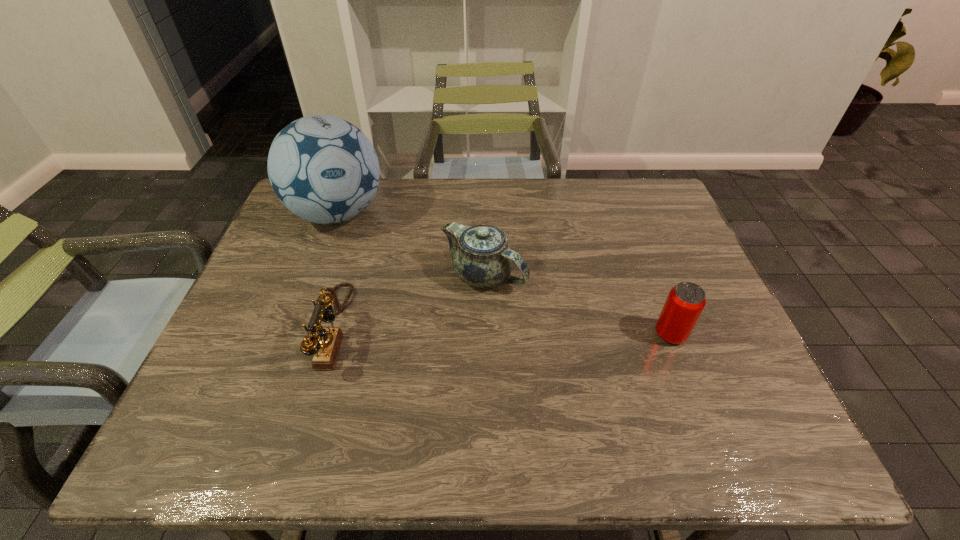
This screenshot has height=540, width=960. Identify the location of telephone. (325, 347).

This screenshot has height=540, width=960. What are the coordinates of `can` in the screenshot? It's located at (685, 302).

Find the location of `the tallest object`. the tallest object is located at coordinates (324, 169).

Identify the location of soccer ball. (324, 169).

Find the location of a particular element. the third object from left to right is located at coordinates (482, 257).

At what (x,y) coordinates should I click in order to perform the action: click on vacant area located on the front-facing side of the telephone. Please return your answer as a coordinate pair (x, y). Looking at the image, I should click on (264, 329).

At what (x,y) coordinates should I click in order to perform the action: click on vacant space located 0.190m on the front-facing side of the telephone. Please return your answer as a coordinate pair (x, y). Looking at the image, I should click on (238, 329).

You are a GUI agent. You are given a task and a screenshot of the screen. Output one action in this format:
    pyautogui.click(x=<x>, y=<y>)
    Task: Click on the vacant space positioned on the front-facing side of the telephone
    
    Given the screenshot: What is the action you would take?
    pyautogui.click(x=229, y=329)

The height and width of the screenshot is (540, 960). Identify the location of vacant position located 0.370m on the back of the can. (629, 225).

You are a GUI agent. You are given a task and a screenshot of the screen. Output one action in this format:
    pyautogui.click(x=<x>, y=<y>)
    Task: Click on the vacant space located 0.310m on the side with brand of the tallest object
    Image resolution: width=960 pixels, height=540 pixels.
    Given the screenshot: What is the action you would take?
    pyautogui.click(x=427, y=297)